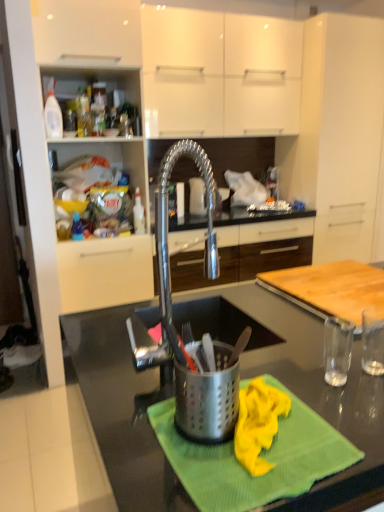
At what (x,y) coordinates should I click in order to perform the action: click on vacant space situated on the left part of polished stainless steel faucet at center. Please return your answer as a coordinate pair (x, y). This screenshot has width=384, height=512. Looking at the image, I should click on (110, 360).